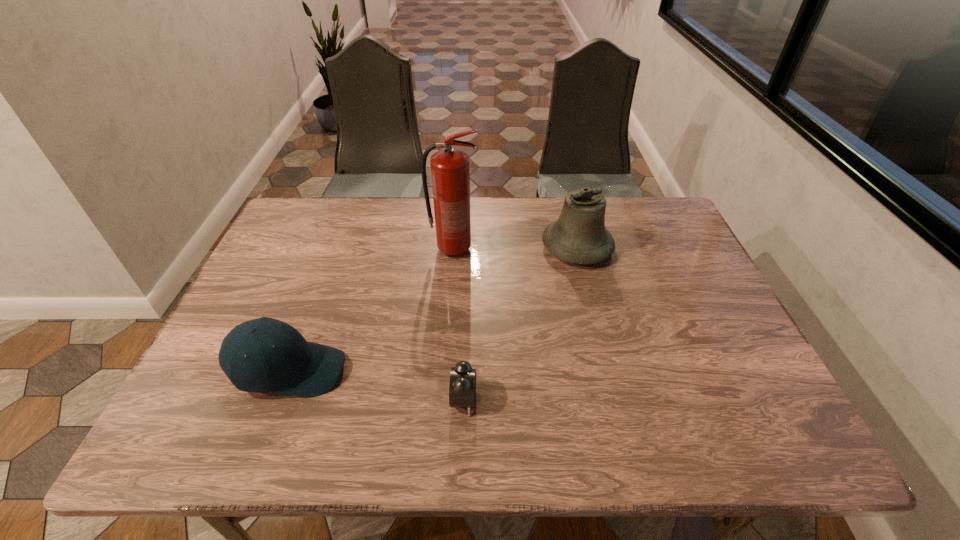
Identify the location of free space between the rightmost object and the shortest object. This screenshot has height=540, width=960. (520, 323).

The image size is (960, 540). Find the location of `vacant area that lies between the tallest object and the third tallest object`. vacant area that lies between the tallest object and the third tallest object is located at coordinates (372, 310).

This screenshot has height=540, width=960. What are the coordinates of `vacant region between the fire extinguisher and the second shortest object` in the screenshot? It's located at (372, 310).

The height and width of the screenshot is (540, 960). I want to click on free point between the fire extinguisher and the leftmost object, so click(372, 310).

The width and height of the screenshot is (960, 540). What are the coordinates of `vacant point located between the alarm clock and the tallest object` in the screenshot? It's located at (458, 325).

What are the coordinates of `vacant area between the leftmost object and the rightmost object` in the screenshot? It's located at (434, 309).

Identify the location of unoccupied area between the second tallest object and the baseball cap. The width and height of the screenshot is (960, 540). (434, 309).

Locate an element on the screen. vacant space that is in between the baseball cap and the third shortest object is located at coordinates (434, 309).

The width and height of the screenshot is (960, 540). What are the coordinates of `vacant space in between the tallest object and the leftmost object` in the screenshot? It's located at (372, 310).

This screenshot has height=540, width=960. What are the coordinates of `object that is the third closest to the tallest object` in the screenshot? It's located at (462, 389).